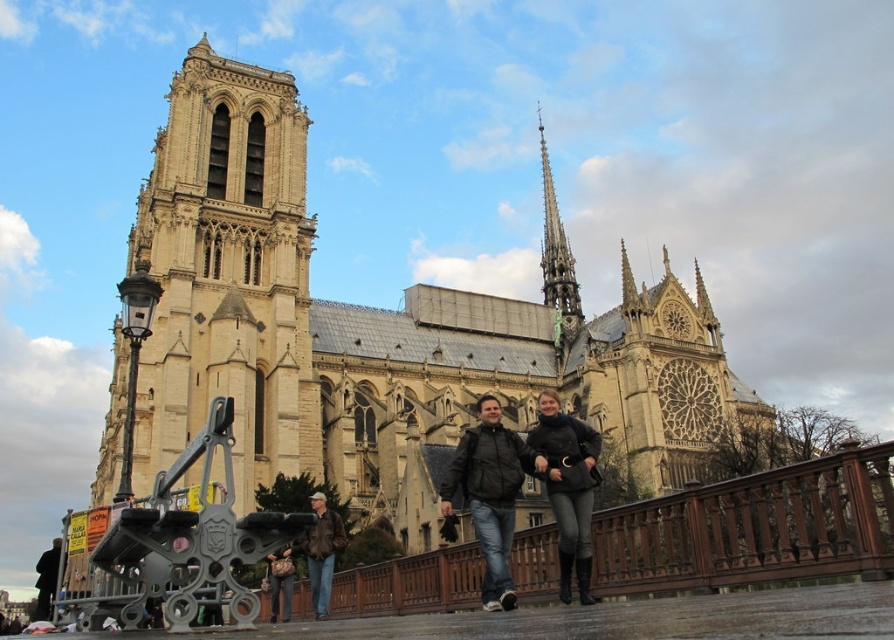
Question: Which point is farther from the camera taking this photo?

Choices:
 (A) (574, 308)
 (B) (319, 509)
 (C) (867, 568)

Answer: (A)

Question: Can you confirm if dark brown leather jacket at center is bigger than leather jacket at center?

Choices:
 (A) yes
 (B) no

Answer: (A)

Question: Which point appears farthest from the camera in this image?

Choices:
 (A) pyautogui.click(x=547, y=440)
 (B) pyautogui.click(x=880, y=452)

Answer: (A)

Question: Can you confirm if dark brown leather jacket at center is bigger than leather jacket at center?

Choices:
 (A) yes
 (B) no

Answer: (A)

Question: Estimate the real-world distances between objects in this image. Which object is closer to the dark gray leather jacket at center?

Choices:
 (A) dark brown leather jacket at center
 (B) beige stone tower at left

Answer: (A)

Question: Can you confirm if beige stone church at center is positioned above dark gray leather jacket at center?

Choices:
 (A) yes
 (B) no

Answer: (A)